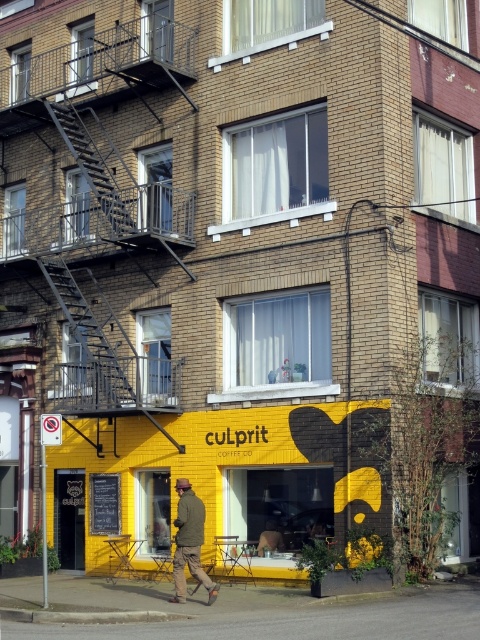
You are a delivery person trying to deliver a package to the camouflage jacket at center. You have a cart that is 1.2 meters wide. Can your cart fit through the space between the black metal fire escape at upper left and the building wall?

The black metal fire escape at upper left is wider than the camouflage jacket at center. However, the exact width of the space between the fire escape and the building wall is not specified in the description, so it is uncertain whether the cart can fit through that space.

You are a delivery person trying to find the culprit COFFEE CO. storefront. You see the black metal fire escape at upper left and the camouflage jacket at center. Which object is positioned more to the left?

The black metal fire escape at upper left is positioned more to the left than the camouflage jacket at center.